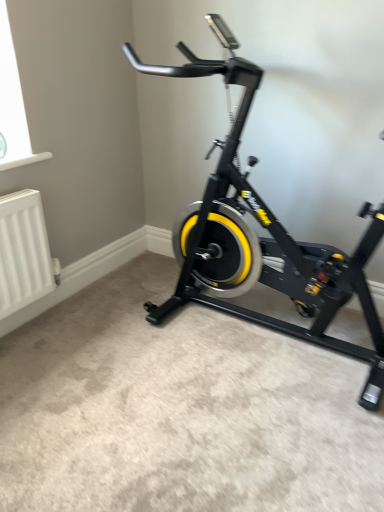
At what (x,y) coordinates should I click in order to perform the action: click on unoccupied area in front of black matte stationary bicycle at center. Please return your answer as a coordinate pair (x, y). Looking at the image, I should click on click(x=242, y=429).